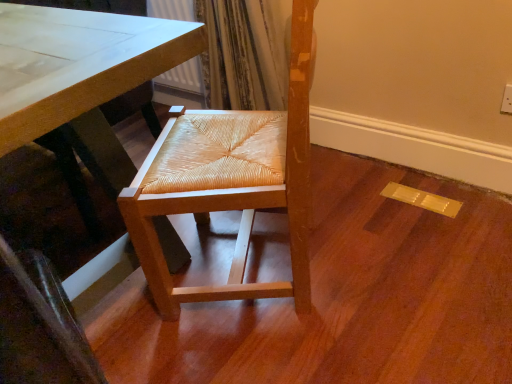
Question: Is natural wood woven seat at center turned away from natural wood chair at center?

Choices:
 (A) no
 (B) yes

Answer: (A)

Question: Does natural wood woven seat at center come behind natural wood chair at center?

Choices:
 (A) no
 (B) yes

Answer: (A)

Question: Could natural wood chair at center be considered to be inside natural wood woven seat at center?

Choices:
 (A) yes
 (B) no

Answer: (B)

Question: Is natural wood woven seat at center outside of natural wood chair at center?

Choices:
 (A) no
 (B) yes

Answer: (B)

Question: Does natural wood woven seat at center turn towards natural wood chair at center?

Choices:
 (A) yes
 (B) no

Answer: (B)

Question: Is natural wood chair at center taller or shorter than matte white table at center?

Choices:
 (A) short
 (B) tall

Answer: (A)

Question: From the image's perspective, is natural wood chair at center located above or below matte white table at center?

Choices:
 (A) below
 (B) above

Answer: (A)

Question: Is natural wood chair at center in front of or behind matte white table at center in the image?

Choices:
 (A) behind
 (B) front

Answer: (A)

Question: Does point (443, 342) appear closer or farther from the camera than point (68, 119)?

Choices:
 (A) closer
 (B) farther

Answer: (B)

Question: Does point (118, 16) appear closer or farther from the camera than point (366, 233)?

Choices:
 (A) farther
 (B) closer

Answer: (B)

Question: Do you think matte white table at center is within natural wood chair at center, or outside of it?

Choices:
 (A) inside
 (B) outside

Answer: (B)

Question: From a real-world perspective, is matte white table at center physically located above or below natural wood chair at center?

Choices:
 (A) below
 (B) above

Answer: (B)

Question: Looking at the image, does matte white table at center seem bigger or smaller compared to natural wood chair at center?

Choices:
 (A) small
 (B) big

Answer: (B)

Question: In terms of height, does natural wood woven seat at center look taller or shorter compared to matte white table at center?

Choices:
 (A) short
 (B) tall

Answer: (B)

Question: From a real-world perspective, is natural wood woven seat at center positioned above or below matte white table at center?

Choices:
 (A) above
 (B) below

Answer: (A)